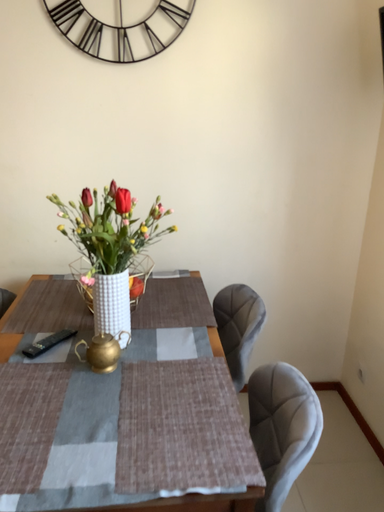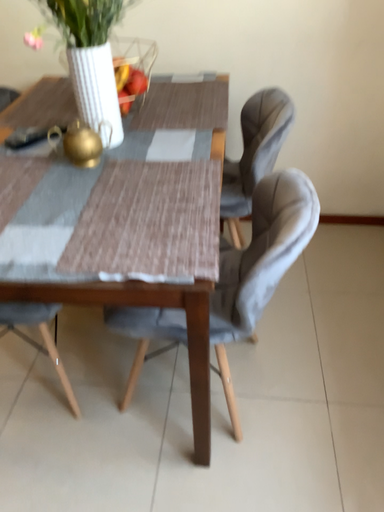
Question: Which way did the camera rotate in the video?

Choices:
 (A) rotated left
 (B) rotated right

Answer: (A)